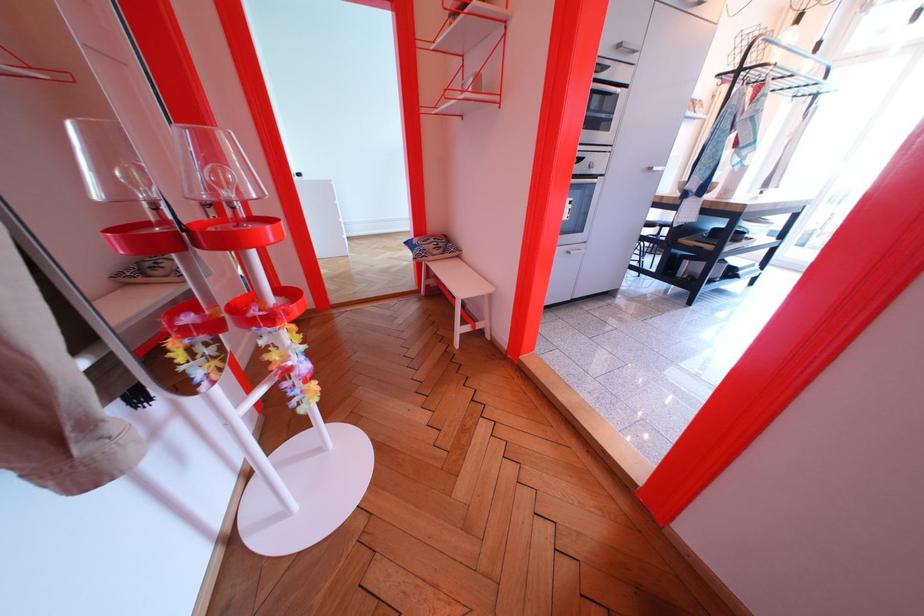
What do you see at coordinates (222, 182) in the screenshot? Image resolution: width=924 pixels, height=616 pixels. I see `a clear light bulb` at bounding box center [222, 182].